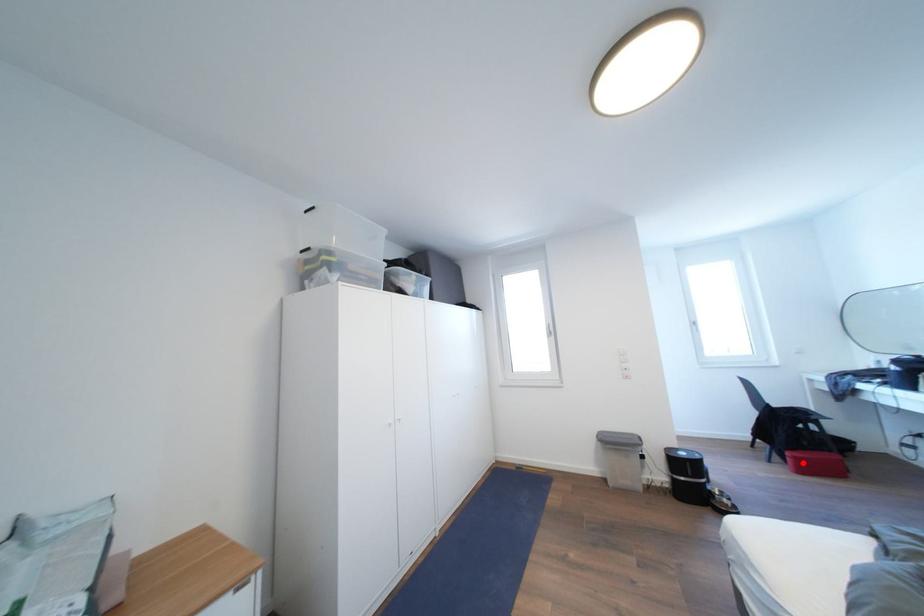
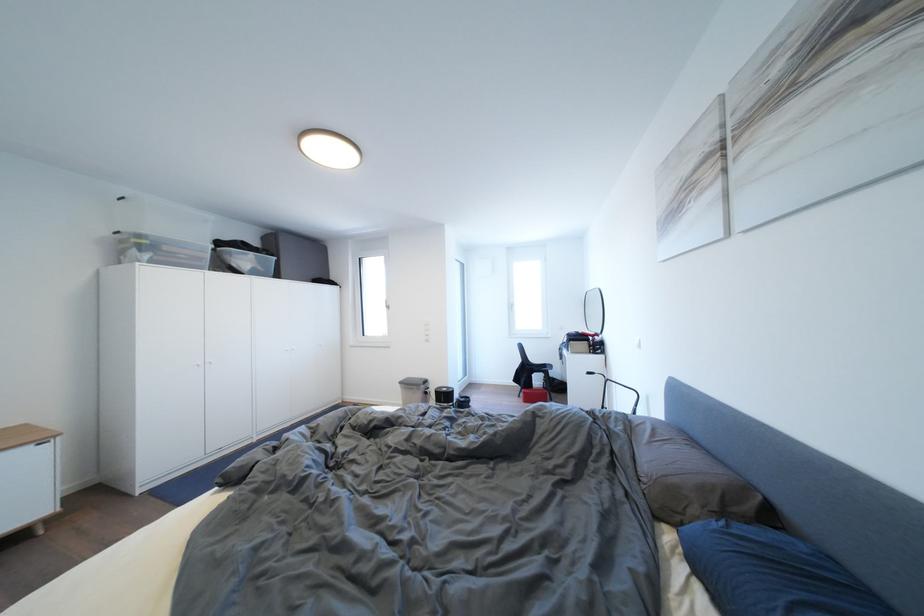
Find the pixel in the second image that matches the highlighted location in the first image.

(532, 398)